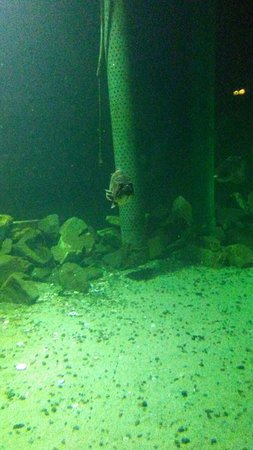
Locate an element on the screen. glowing lights is located at coordinates pyautogui.click(x=241, y=91), pyautogui.click(x=235, y=92).